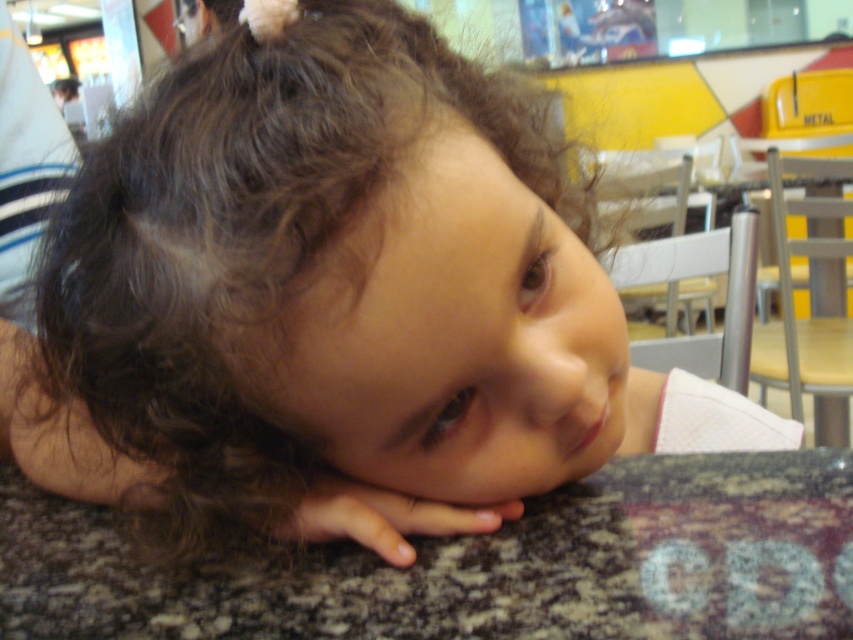
Is granite table at lower center positioned in front of smooth skin hand at lower center?

Yes, it is.

Which is more to the right, granite table at lower center or smooth skin hand at lower center?

smooth skin hand at lower center

Identify the location of granite table at lower center. This screenshot has width=853, height=640. (480, 564).

You are a GUI agent. You are given a task and a screenshot of the screen. Output one action in this format:
    pyautogui.click(x=<x>, y=<y>)
    Task: Click on the granite table at lower center
    
    Given the screenshot: What is the action you would take?
    pyautogui.click(x=480, y=564)